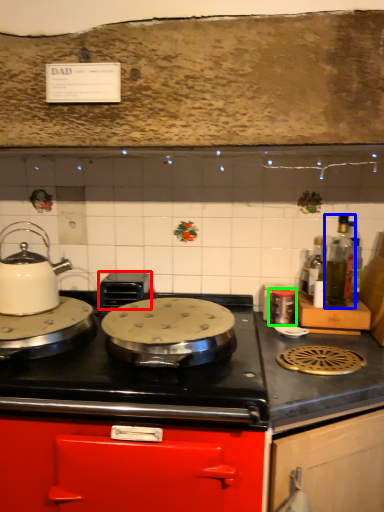
Question: Estimate the real-world distances between objects in this image. Which object is closer to appliance (highlighted by a red box), bottle (highlighted by a blue box) or kitchen appliance (highlighted by a green box)?

Choices:
 (A) bottle
 (B) kitchen appliance

Answer: (B)